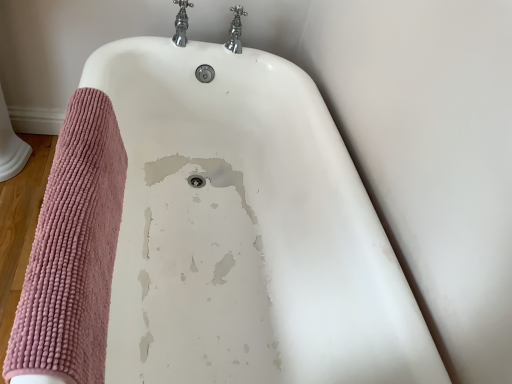
Where is `free space above pink chenille bath towel at left (from a real-world perspective)`? free space above pink chenille bath towel at left (from a real-world perspective) is located at coordinates (61, 196).